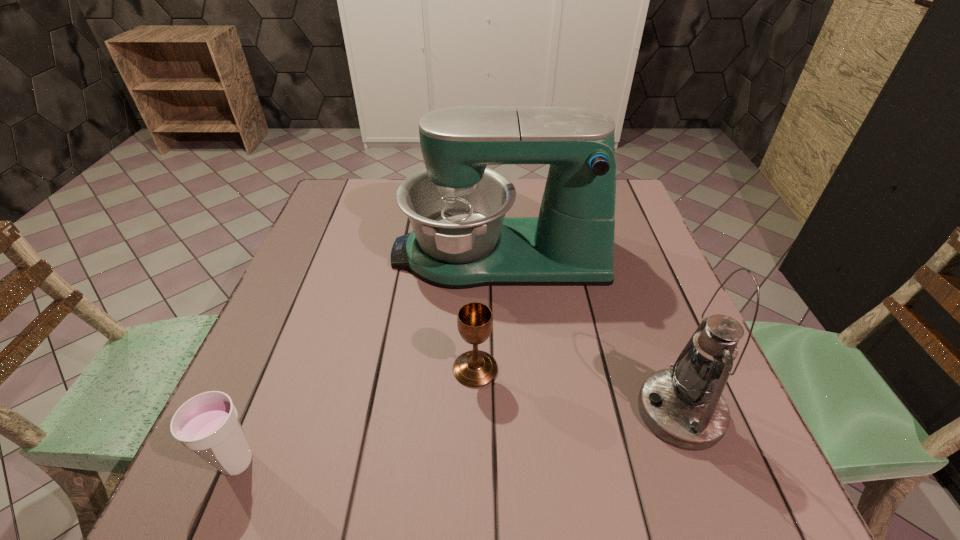
Find the location of `free region at the near left corner`. free region at the near left corner is located at coordinates (244, 479).

At what (x,y) coordinates should I click in order to perform the action: click on unoccupied area between the chalice and the oil lamp. Please return your answer as a coordinate pair (x, y). The image size is (960, 540). Looking at the image, I should click on (578, 390).

Image resolution: width=960 pixels, height=540 pixels. In order to click on free spot between the cup and the mixer in this screenshot , I will do `click(368, 359)`.

This screenshot has height=540, width=960. In order to click on vacant space that is in between the oil lamp and the mixer in this screenshot , I will do `click(589, 333)`.

This screenshot has height=540, width=960. What are the coordinates of `vacant space that's between the oil lamp and the mixer` in the screenshot? It's located at (589, 333).

Where is `free space between the oil lamp and the cup`? The height and width of the screenshot is (540, 960). free space between the oil lamp and the cup is located at coordinates click(459, 437).

Find the location of a particular element. free area in between the oil lamp and the cup is located at coordinates (459, 437).

I want to click on free area in between the oil lamp and the chalice, so click(578, 390).

At what (x,y) coordinates should I click in order to perform the action: click on free space between the chalice and the cup. Please return your answer as a coordinate pair (x, y). This screenshot has width=960, height=540. Looking at the image, I should click on (356, 416).

At what (x,y) coordinates should I click in order to perform the action: click on unoccupied area between the leftmost object and the farthest object. Please return your answer as a coordinate pair (x, y). The width and height of the screenshot is (960, 540). Looking at the image, I should click on (368, 359).